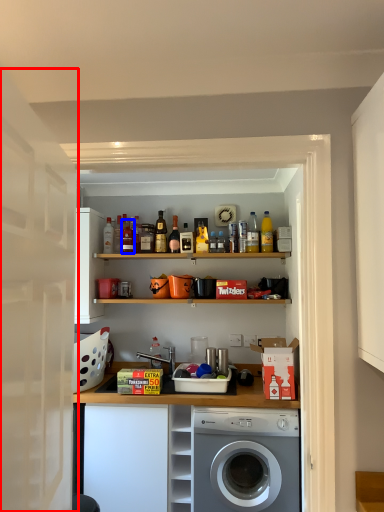
Question: Which object is closer to the camera taking this photo, door (highlighted by a red box) or bottle (highlighted by a blue box)?

Choices:
 (A) door
 (B) bottle

Answer: (A)